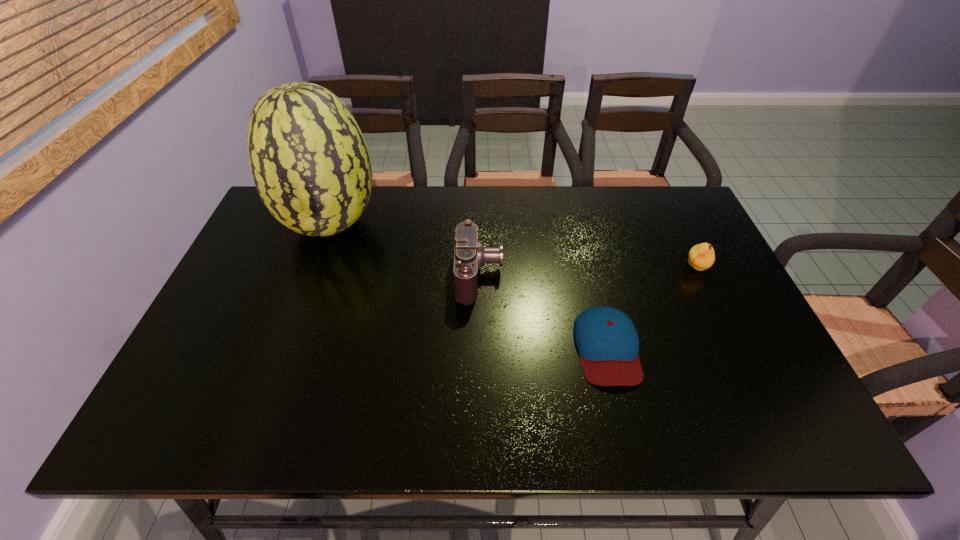
Locate an element on the screen. The image size is (960, 540). the leftmost object is located at coordinates (310, 164).

This screenshot has width=960, height=540. I want to click on the tallest object, so click(x=310, y=164).

This screenshot has height=540, width=960. Find the location of `the third object from right to left`. the third object from right to left is located at coordinates (470, 255).

Where is `the third shortest object`? the third shortest object is located at coordinates (470, 255).

You are a GUI agent. You are given a task and a screenshot of the screen. Output one action in this format:
    pyautogui.click(x=<x>, y=<y>)
    Task: Click on the second shortest object
    The height and width of the screenshot is (540, 960).
    Given the screenshot: What is the action you would take?
    pyautogui.click(x=702, y=256)

This screenshot has width=960, height=540. What are the coordinates of `the rightmost object` in the screenshot? It's located at (702, 256).

The width and height of the screenshot is (960, 540). What are the coordinates of `the third object from left to right` in the screenshot? It's located at (607, 341).

You are a GUI agent. You are given a task and a screenshot of the screen. Output one action in this format:
    pyautogui.click(x=<x>, y=<y>)
    Task: Click on the shortest object
    This screenshot has height=540, width=960.
    Given the screenshot: What is the action you would take?
    pyautogui.click(x=607, y=341)

You are a GUI agent. You are given a task and a screenshot of the screen. Output one action in this format:
    pyautogui.click(x=<x>, y=<y>)
    Task: Click on the free spot located on the right of the leftmost object
    This screenshot has width=960, height=540.
    Given the screenshot: What is the action you would take?
    pyautogui.click(x=404, y=226)

This screenshot has height=540, width=960. I want to click on vacant region located 0.390m on the front-facing side of the second tallest object, so click(646, 274).